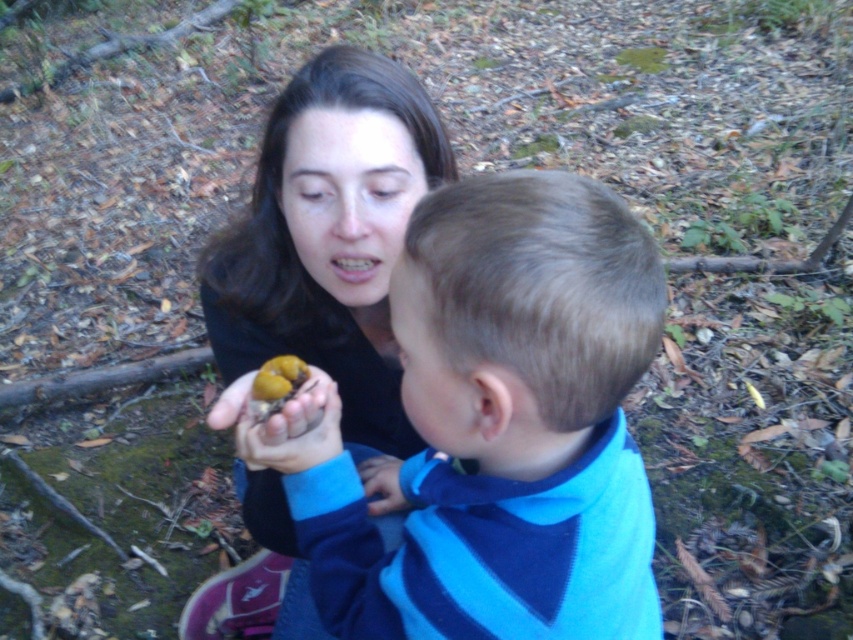
Question: Does blue striped sweater at center have a lesser width compared to matte black sweater at center?

Choices:
 (A) yes
 (B) no

Answer: (B)

Question: Is blue striped sweater at center below matte black sweater at center?

Choices:
 (A) no
 (B) yes

Answer: (B)

Question: Which of the following is the farthest from the observer?

Choices:
 (A) (471, 204)
 (B) (368, 307)

Answer: (B)

Question: Is blue striped sweater at center smaller than matte black sweater at center?

Choices:
 (A) yes
 (B) no

Answer: (A)